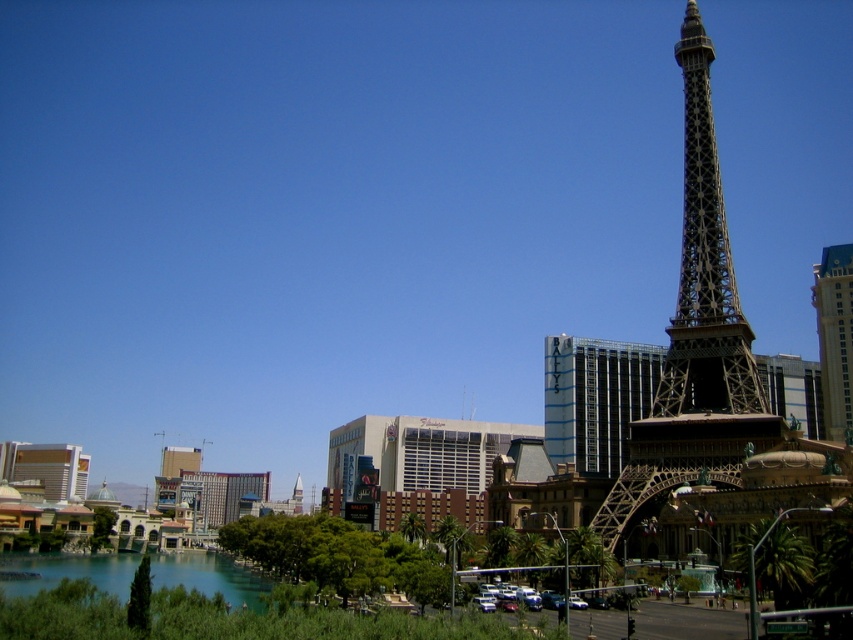
Question: Does metallic gold eiffel tower at right come in front of clear glass waterway at lower left?

Choices:
 (A) no
 (B) yes

Answer: (B)

Question: Which object is the farthest from the gold metallic hotel at right?

Choices:
 (A) metallic brown eiffel tower at center
 (B) metallic gold eiffel tower at right

Answer: (B)

Question: Is metallic gold eiffel tower at right bigger than clear glass waterway at lower left?

Choices:
 (A) no
 (B) yes

Answer: (B)

Question: Is metallic gold eiffel tower at right bigger than clear glass waterway at lower left?

Choices:
 (A) yes
 (B) no

Answer: (A)

Question: Which object is the closest to the metallic gold eiffel tower at right?

Choices:
 (A) metallic silver hotel at center
 (B) gold metallic hotel at right
 (C) metallic brown eiffel tower at center

Answer: (C)

Question: Which point is farther from the camera taking this photo?

Choices:
 (A) (732, 349)
 (B) (44, 564)
 (C) (701, 74)

Answer: (B)